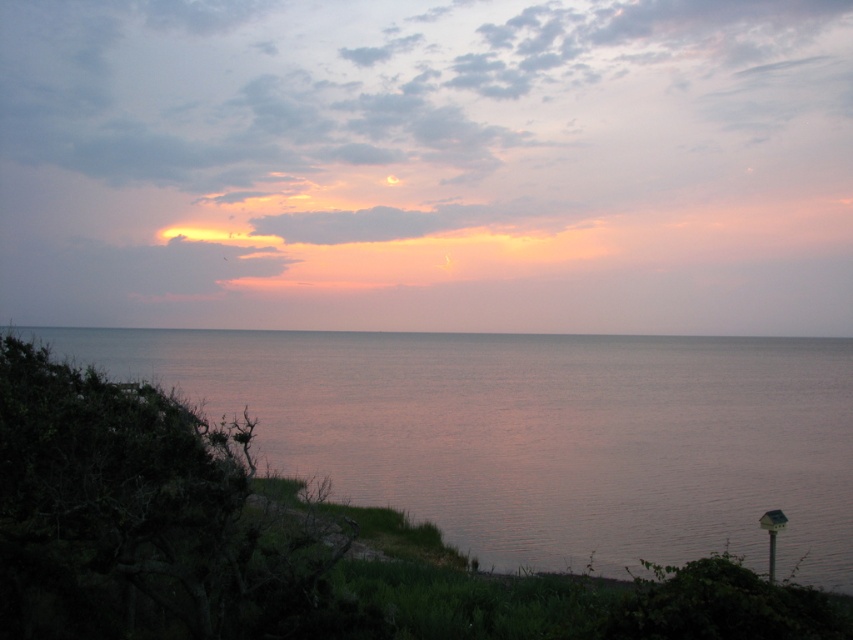
Who is taller, pastel pink cloud at upper center or gray matte horizon at center?

Standing taller between the two is pastel pink cloud at upper center.

Consider the image. Is pastel pink cloud at upper center above gray matte horizon at center?

Yes, pastel pink cloud at upper center is above gray matte horizon at center.

This screenshot has height=640, width=853. What do you see at coordinates (425, 163) in the screenshot?
I see `pastel pink cloud at upper center` at bounding box center [425, 163].

You are a GUI agent. You are given a task and a screenshot of the screen. Output one action in this format:
    pyautogui.click(x=<x>, y=<y>)
    Task: Click on the pastel pink cloud at upper center
    This screenshot has height=640, width=853.
    Given the screenshot: What is the action you would take?
    pyautogui.click(x=425, y=163)

What do you see at coordinates (538, 435) in the screenshot? I see `smooth water at lower left` at bounding box center [538, 435].

Which is in front, point (207, 392) or point (221, 324)?

Point (207, 392) is more forward.

Locate an element on the screen. smooth water at lower left is located at coordinates click(538, 435).

Between pastel pink cloud at upper center and smooth water at lower left, which one appears on the right side from the viewer's perspective?

smooth water at lower left is more to the right.

Does pastel pink cloud at upper center appear on the left side of smooth water at lower left?

Yes, pastel pink cloud at upper center is to the left of smooth water at lower left.

Which is behind, point (762, 150) or point (811, 504)?

Point (762, 150)

Where is `pastel pink cloud at upper center`? The image size is (853, 640). pastel pink cloud at upper center is located at coordinates (425, 163).